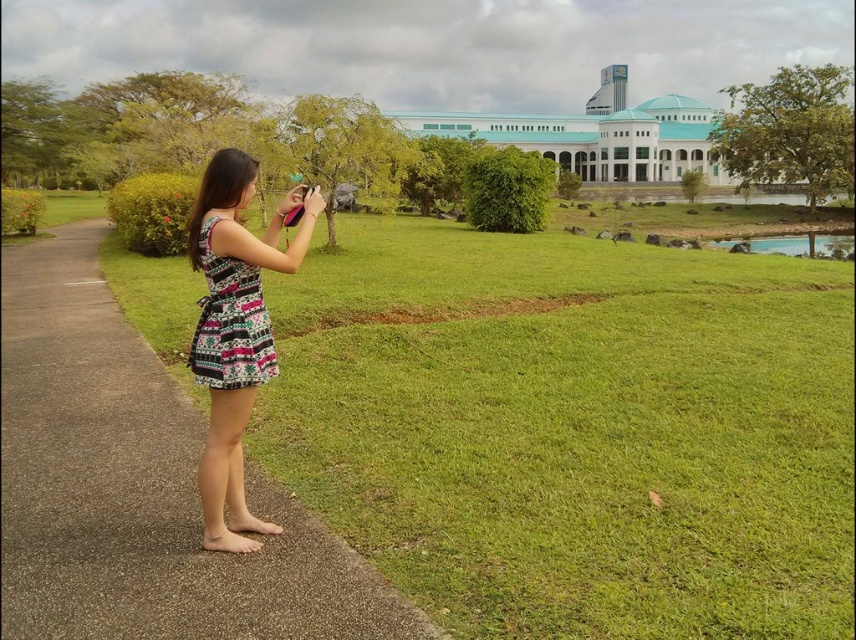
Can you confirm if pavement at left is shorter than patterned fabric dress at center?

Indeed, pavement at left has a lesser height compared to patterned fabric dress at center.

Does pavement at left have a smaller size compared to patterned fabric dress at center?

Actually, pavement at left might be larger than patterned fabric dress at center.

Does point (98, 269) come farther from viewer compared to point (247, 266)?

Yes, point (98, 269) is farther from viewer.

Locate an element on the screen. This screenshot has width=856, height=640. pavement at left is located at coordinates (140, 486).

Between patterned fabric dress at center and printed fabric dress at center, which one is positioned higher?

printed fabric dress at center

Is point (278, 529) closer to viewer compared to point (195, 381)?

No, (278, 529) is behind (195, 381).

Locate an element on the screen. The width and height of the screenshot is (856, 640). patterned fabric dress at center is located at coordinates (235, 330).

Looking at this image, can you confirm if pavement at left is bigger than printed fabric dress at center?

Yes, pavement at left is bigger than printed fabric dress at center.

Is point (80, 528) positioned before point (224, 257)?

No, it is behind (224, 257).

Locate an element on the screen. pavement at left is located at coordinates (140, 486).